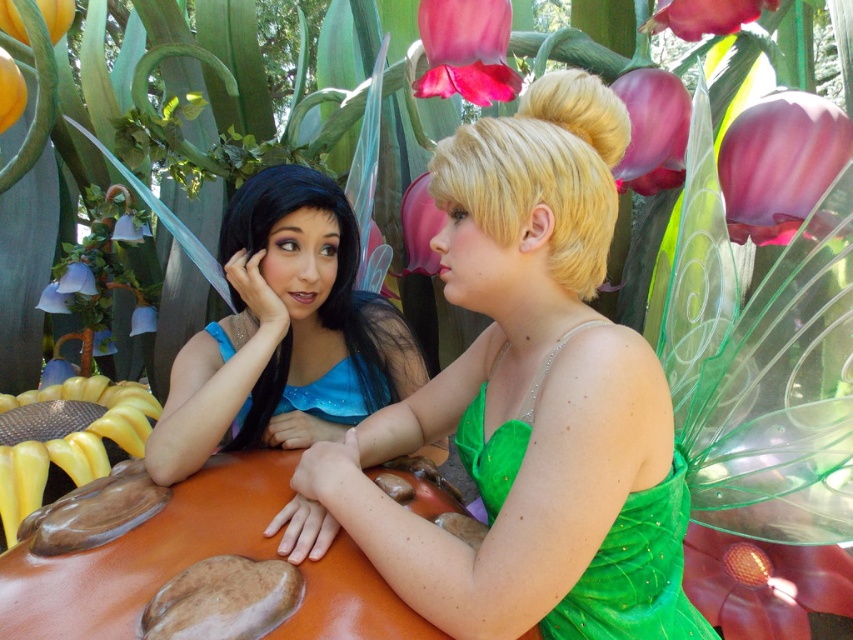
Is green shimmering dress at center to the left of satin blue dress at left from the viewer's perspective?

No, green shimmering dress at center is not to the left of satin blue dress at left.

Is point (523, 436) behind point (230, 428)?

No, (523, 436) is in front of (230, 428).

Find the location of `green shimmering dress at center`. green shimmering dress at center is located at coordinates (635, 573).

Does pink translucent flower at upper center have a larger size compared to matte plastic flower at center?

Yes.

Can you confirm if pink translucent flower at upper center is positioned to the right of matte plastic flower at center?

Correct, you'll find pink translucent flower at upper center to the right of matte plastic flower at center.

Image resolution: width=853 pixels, height=640 pixels. Describe the element at coordinates (421, 227) in the screenshot. I see `pink translucent flower at upper center` at that location.

At what (x,y) coordinates should I click in order to perform the action: click on pink translucent flower at upper center. Please return your answer as a coordinate pair (x, y). The image size is (853, 640). Looking at the image, I should click on (421, 227).

Does point (506, 77) come in front of point (653, 26)?

No, it is behind (653, 26).

Locate an element on the screen. This screenshot has height=640, width=853. pink silky petal at upper center is located at coordinates (466, 51).